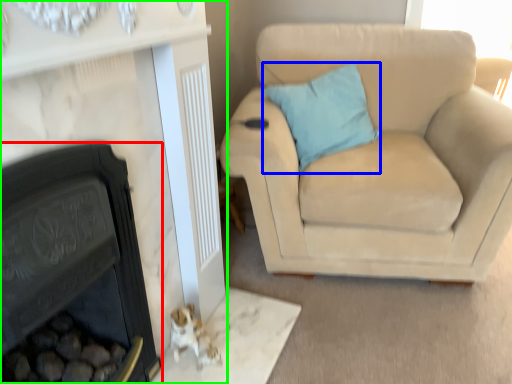
Question: Which object is positioned farthest from fireplace (highlighted by a red box)? Select from pillow (highlighted by a blue box) and fireplace (highlighted by a green box).

Choices:
 (A) pillow
 (B) fireplace

Answer: (A)